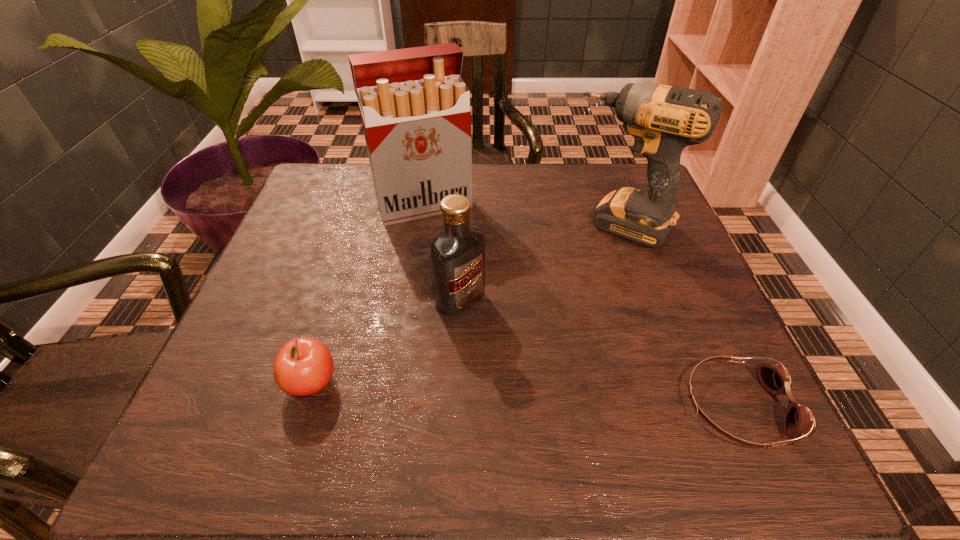
At what (x,y) coordinates should I click in order to perform the action: click on vacant space on the desktop that is between the second shortest object and the shortest object and is positioned with the lid open on the cigarette case. Please return your answer as a coordinate pair (x, y). This screenshot has width=960, height=540. Looking at the image, I should click on (511, 394).

What are the coordinates of `free space on the desktop that is between the second shortest object and the shortest object and is positioned with the drill bit of the drill facing forward` in the screenshot? It's located at (515, 394).

Locate an element on the screen. The image size is (960, 540). vacant space on the desktop that is between the fourth tallest object and the shortest object and is positioned on the front-facing side of the third shortest object is located at coordinates (569, 397).